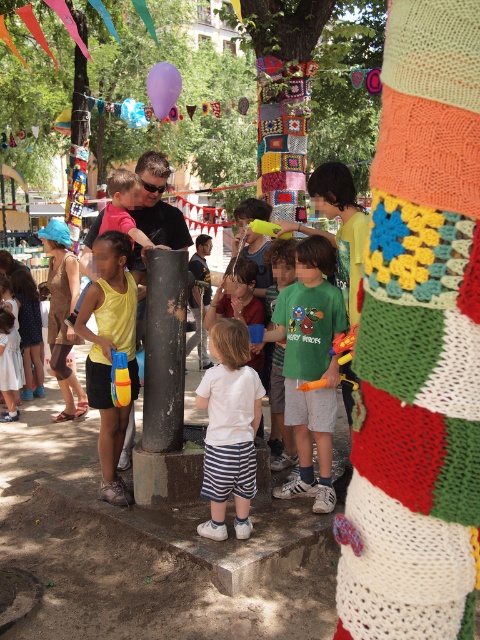
You are a photographer trying to capture a group photo of the green matte shirt at center and the yellow matte tank top at left. What is the minimum distance you need to maintain between them to ensure both are in frame?

The green matte shirt at center and yellow matte tank top at left are 3.71 feet apart, so you need to maintain at least 3.71 feet between them to ensure both are in frame.

You are a photographer at the event and want to take a picture of the black cylindrical structure and ensure the point at coordinates point (228, 428) is visible in the frame. Since the point is on the white cotton shirt at center, where should you position the camera relative to the black cylindrical structure and the white cotton shirt at center?

The point at coordinates point (228, 428) is on the white cotton shirt at center, so to include both the black cylindrical structure and the point in the frame, position the camera so it faces the white cotton shirt at center while ensuring the black cylindrical structure is within the same field of view.